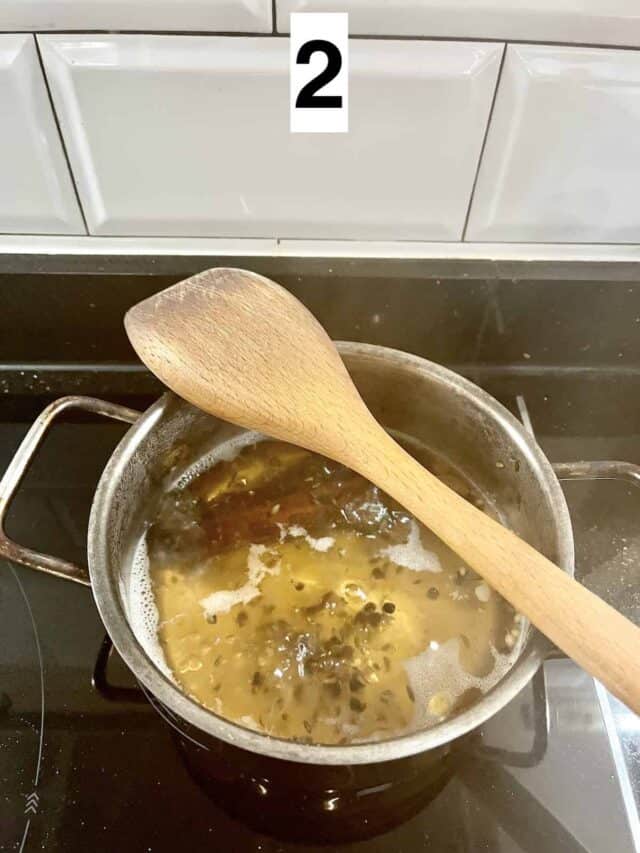
Where is `background, white subway title`? The height and width of the screenshot is (853, 640). background, white subway title is located at coordinates (29, 91).